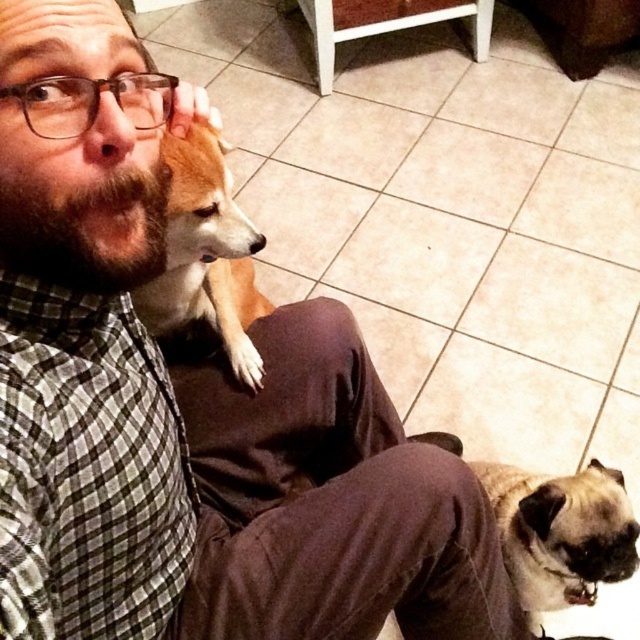
You are a photographer trying to capture the perfect shot of the two dogs in the scene. You want to ensure both dogs are in focus. Given that your camera can only focus on objects within a 0.5 unit distance from the focal point, where should you set your focal point to include both point (192, 161) and point (577, 570)?

To include both points within the 0.5 unit focus range, the focal point should be set at the midpoint between point (192, 161) and point (577, 570). This ensures both points are within the 0.5 unit distance required for sharp focus.